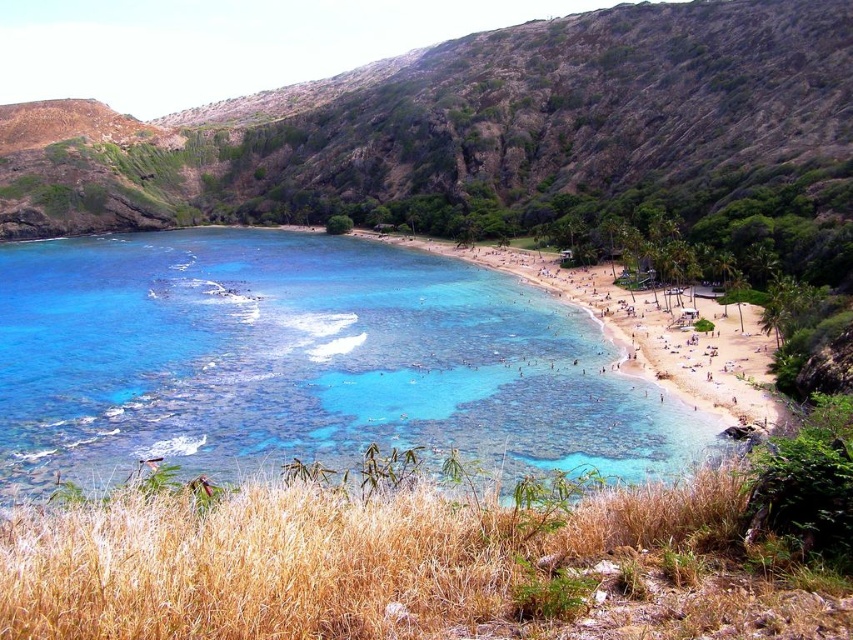
Describe the element at coordinates (305, 362) in the screenshot. I see `clear blue water at center` at that location.

The width and height of the screenshot is (853, 640). Find the location of `clear blue water at center`. clear blue water at center is located at coordinates (305, 362).